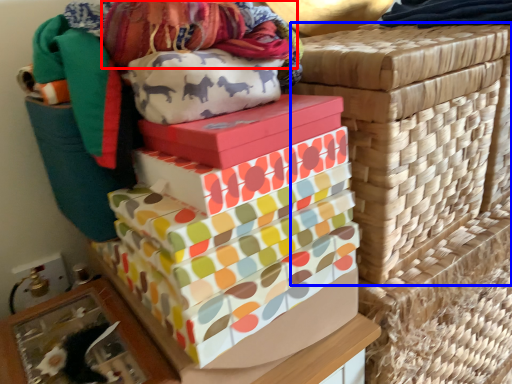
Question: Which point is closer to the camera, fabric (highlighted by a red box) or basket container (highlighted by a blue box)?

Choices:
 (A) fabric
 (B) basket container

Answer: (A)